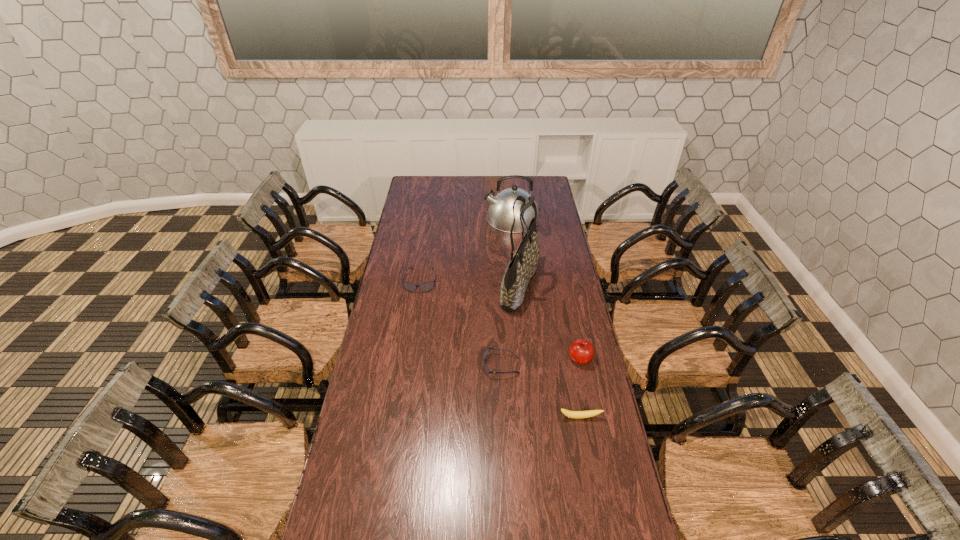
Please point a spot to add another sunglasses on the right. Please provide its 2D coordinates. Your answer should be formatted as a tuple, i.e. [(x, y)], where the tuple contains the x and y coordinates of a point satisfying the conditions above.

[(627, 497)]